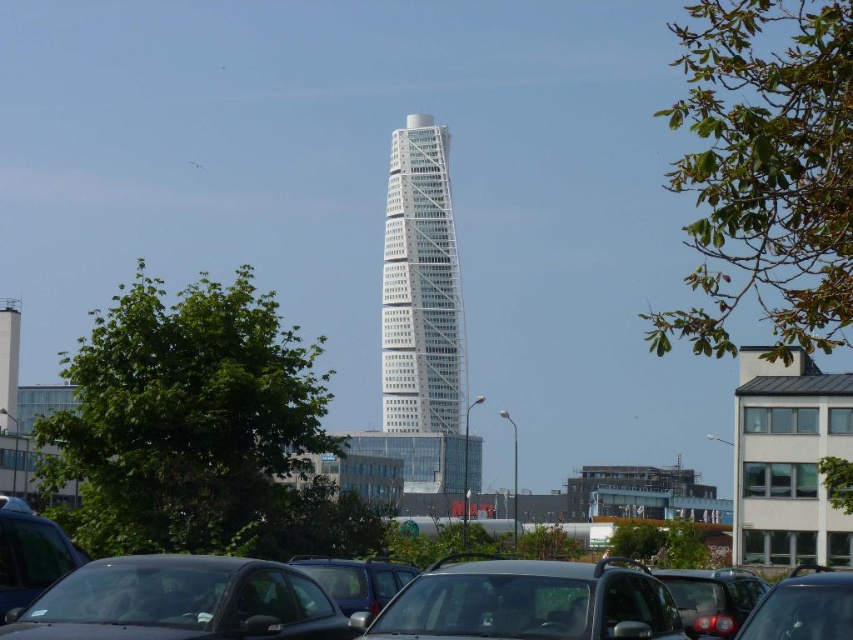
At what (x,y) coordinates should I click in order to perform the action: click on matte black car at center. Please return your answer as a coordinate pair (x, y). Image resolution: width=853 pixels, height=640 pixels. Looking at the image, I should click on (526, 604).

At what (x,y) coordinates should I click in order to perform the action: click on matte black car at center. Please return your answer as a coordinate pair (x, y). Looking at the image, I should click on (526, 604).

Can you confirm if matte black car at center is taller than black matte car at lower center?

Correct, matte black car at center is much taller as black matte car at lower center.

Is matte black car at center to the right of black matte car at lower center from the viewer's perspective?

Indeed, matte black car at center is positioned on the right side of black matte car at lower center.

Between point (636, 573) and point (582, 572), which one is positioned in front?

Point (582, 572)

Identify the location of matte black car at center. Image resolution: width=853 pixels, height=640 pixels. (526, 604).

Is black matte car at lower center taller than shiny black car at lower right?

In fact, black matte car at lower center may be shorter than shiny black car at lower right.

Find the location of a particular element. This screenshot has width=853, height=640. black matte car at lower center is located at coordinates (529, 602).